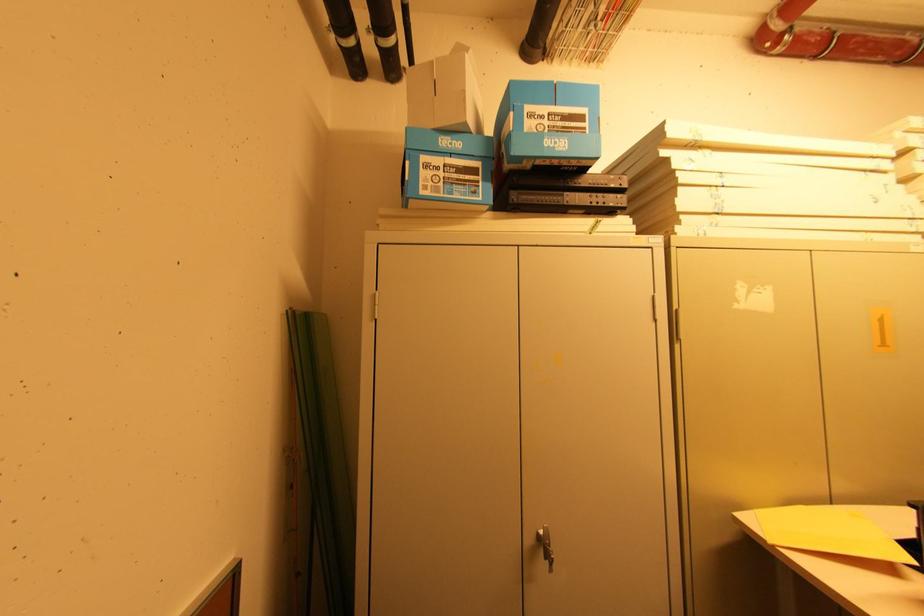
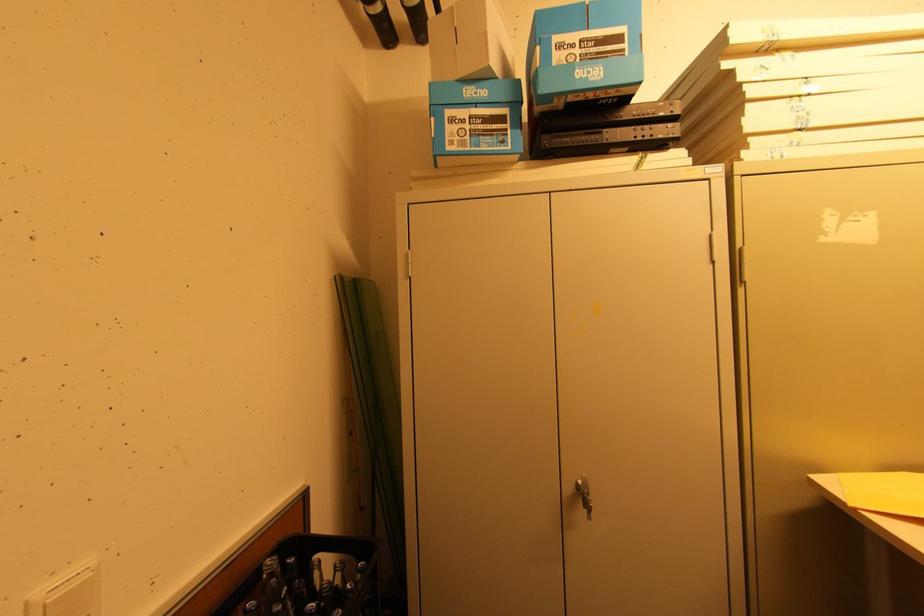
Find the pixel in the second image that matches (487,180) in the first image.

(515, 129)